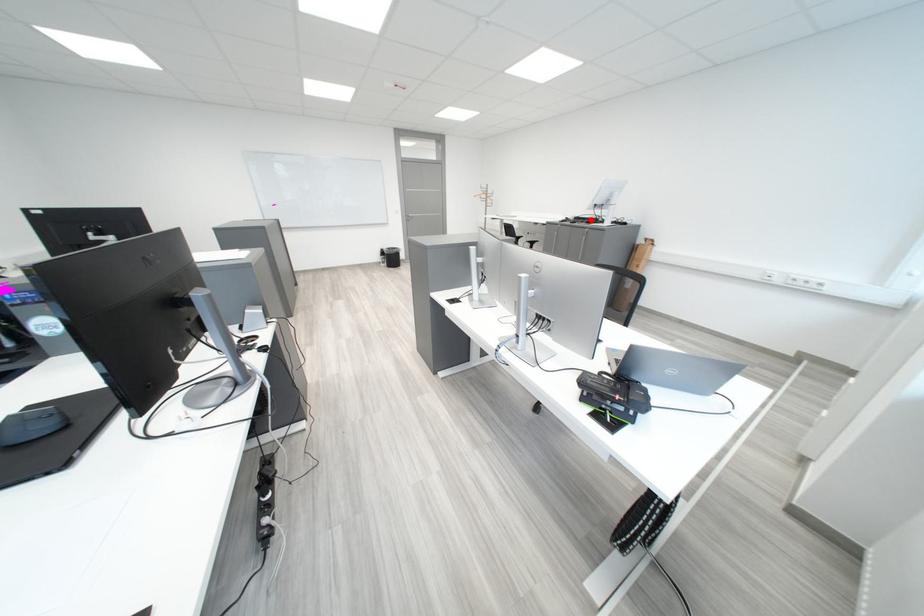
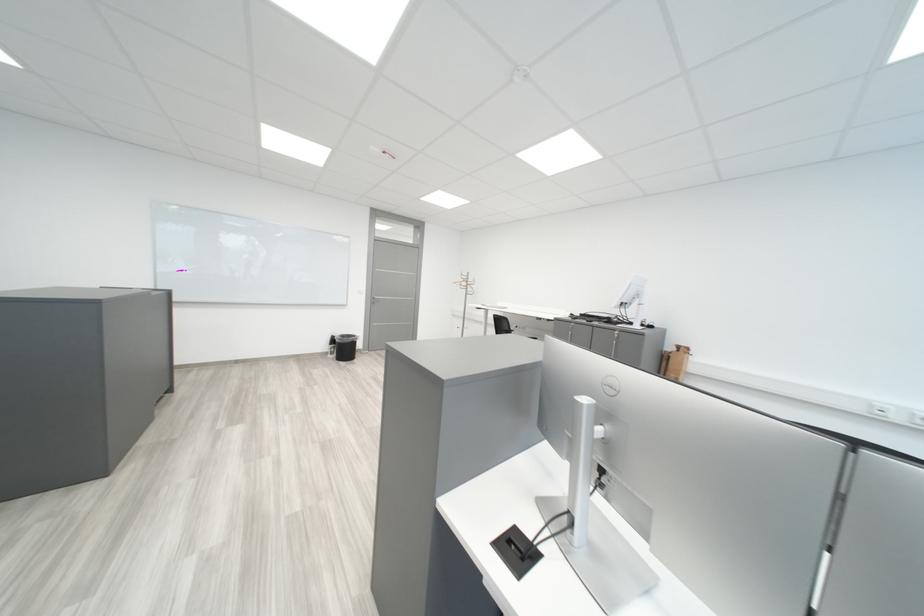
Question: I am providing you with two images of the same scene from different viewpoints. A red point is marked on the first image. Can you still see the location of the red point in image 2?

Choices:
 (A) Yes
 (B) No

Answer: (A)